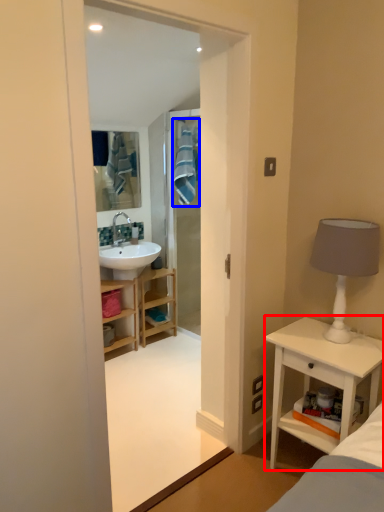
Question: Which of the following is the closest to the observer, nightstand (highlighted by a red box) or bath towel (highlighted by a blue box)?

Choices:
 (A) nightstand
 (B) bath towel

Answer: (A)